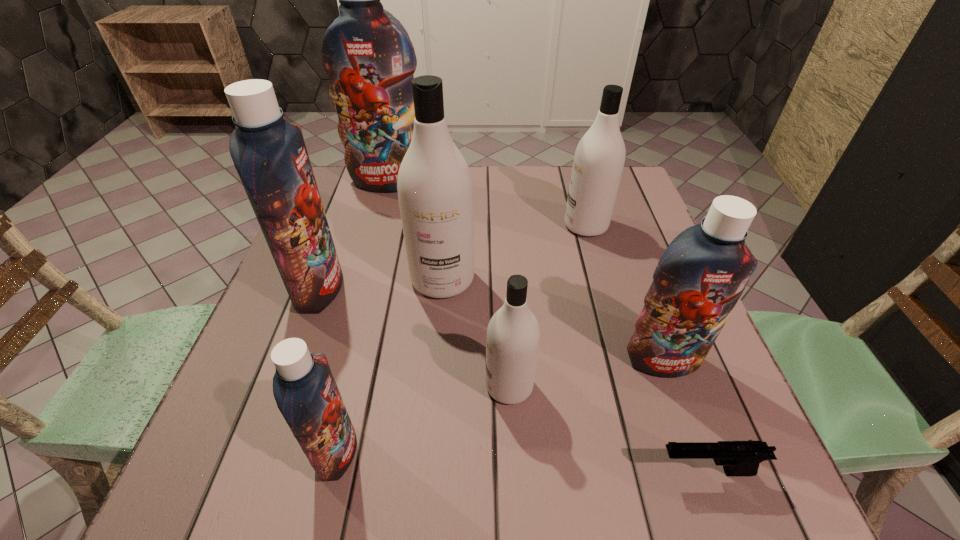
Image resolution: width=960 pixels, height=540 pixels. In order to click on shampoo located in the near edge section of the desktop in this screenshot , I will do `click(304, 388)`.

You are a GUI agent. You are given a task and a screenshot of the screen. Output one action in this format:
    pyautogui.click(x=<x>, y=<y>)
    Task: Click on the pistol that is at the near edge
    
    Given the screenshot: What is the action you would take?
    pyautogui.click(x=739, y=458)

Where is `pistol that is positioned at the right edge`? The height and width of the screenshot is (540, 960). pistol that is positioned at the right edge is located at coordinates (739, 458).

Where is `object situated at the far left corner`? object situated at the far left corner is located at coordinates (366, 52).

Where is `object located at the near right corner`? object located at the near right corner is located at coordinates (739, 458).

I want to click on free space at the far edge of the desktop, so click(378, 212).

Find the location of `vacant space at the near edge`. vacant space at the near edge is located at coordinates (509, 477).

Locate an element on the screen. Image resolution: width=960 pixels, height=540 pixels. vacant space at the left edge of the desktop is located at coordinates (220, 420).

Find the location of a particular element. The image size is (960, 540). vacant area at the right edge is located at coordinates (681, 409).

I want to click on free space at the far left corner, so click(351, 212).